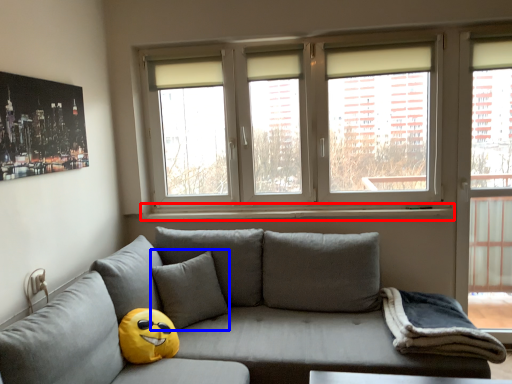
Question: Which point is closer to the camera, window sill (highlighted by a red box) or pillow (highlighted by a blue box)?

Choices:
 (A) window sill
 (B) pillow

Answer: (B)